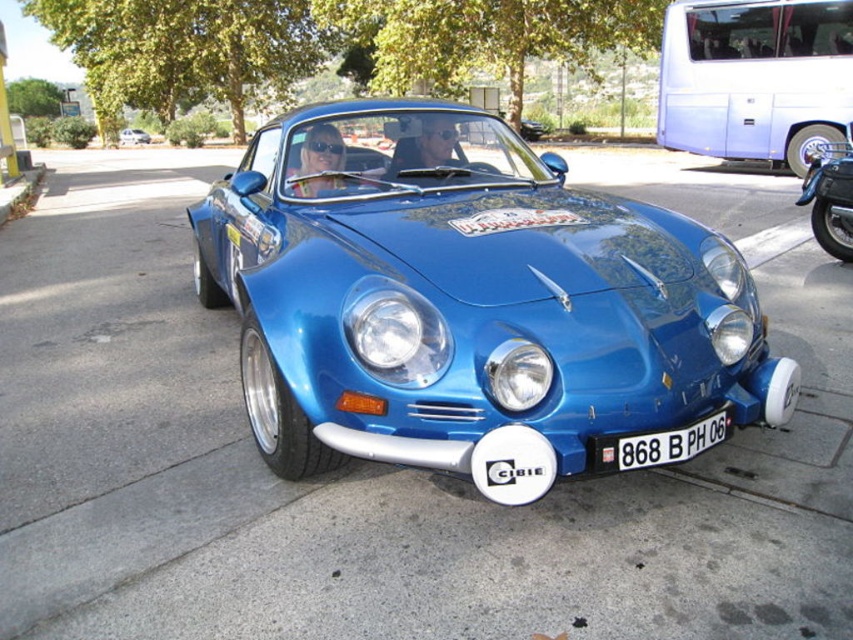
Question: Is white metallic bus at upper right above white plastic license plate at center?

Choices:
 (A) no
 (B) yes

Answer: (B)

Question: Which point appears farthest from the camera in this image?

Choices:
 (A) (848, 40)
 (B) (430, 460)
 (C) (828, 198)
 (D) (135, 140)

Answer: (D)

Question: Considering the relative positions of shiny blue car at center and blue metallic motorcycle at right in the image provided, where is shiny blue car at center located with respect to blue metallic motorcycle at right?

Choices:
 (A) left
 (B) right

Answer: (A)

Question: Can you confirm if white metallic bus at upper right is wider than blue metallic motorcycle at right?

Choices:
 (A) no
 (B) yes

Answer: (A)

Question: Which of the following is the farthest from the observer?

Choices:
 (A) (138, 141)
 (B) (814, 202)
 (C) (619, 440)

Answer: (A)

Question: Estimate the real-world distances between objects in this image. Which object is farther from the blue metallic motorcycle at right?

Choices:
 (A) white metallic bus at upper right
 (B) metallic blue car at center
 (C) shiny blue car at center

Answer: (B)